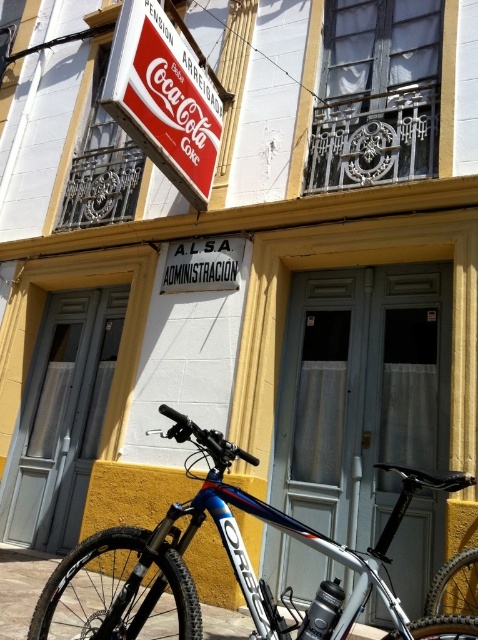
Who is positioned more to the left, shiny blue frame at lower center or red matte coca-cola sign at upper left?

red matte coca-cola sign at upper left is more to the left.

Where is `shiny blue frame at lower center`? The height and width of the screenshot is (640, 478). shiny blue frame at lower center is located at coordinates (236, 563).

Who is more forward, (x=348, y=566) or (x=217, y=134)?

Point (x=348, y=566)

Locate an element on the screen. shiny blue frame at lower center is located at coordinates (236, 563).